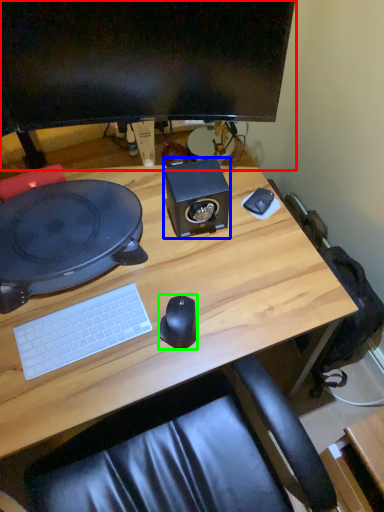
Question: Which object is the farthest from computer monitor (highlighted by a red box)? Choose among these: speaker (highlighted by a blue box) or mouse (highlighted by a green box).

Choices:
 (A) speaker
 (B) mouse

Answer: (B)